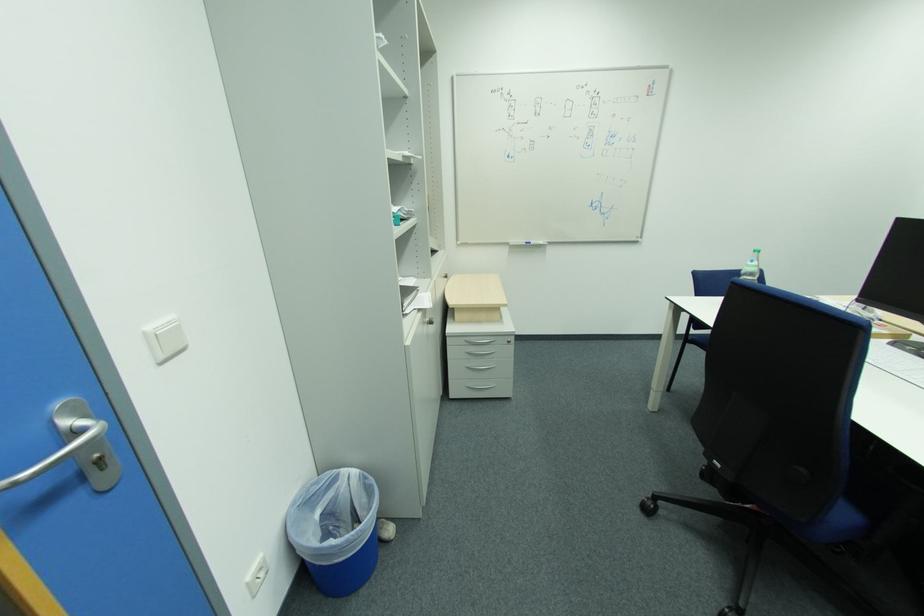
Describe the element at coordinates (76, 448) in the screenshot. I see `the silver door handle` at that location.